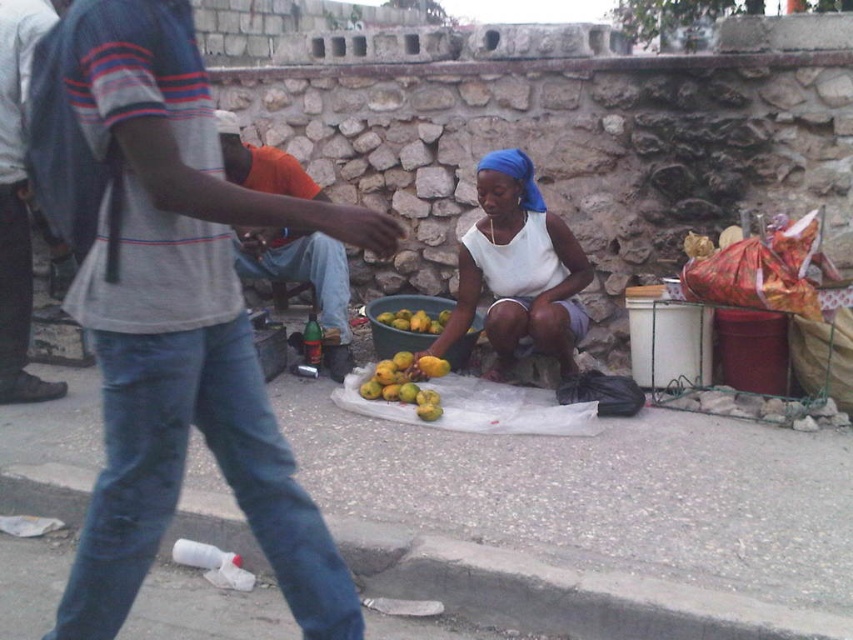
Question: Based on their relative distances, which object is nearer to the yellow matte pears at center?

Choices:
 (A) white matte tank top at center
 (B) orange fabric shirt at center

Answer: (A)

Question: Based on their relative distances, which object is farther from the smooth concrete pavement at center?

Choices:
 (A) orange fabric shirt at center
 (B) denim jeans at center
 (C) white matte tank top at center
 (D) yellow matte pears at center

Answer: (B)

Question: Which point is closer to the camera?

Choices:
 (A) (445, 324)
 (B) (195, 180)
 (C) (236, 150)

Answer: (B)

Question: Is smooth concrete pavement at center bigger than white matte tank top at center?

Choices:
 (A) no
 (B) yes

Answer: (B)

Question: Is the position of orange fabric shirt at center less distant than that of yellow matte pears at center?

Choices:
 (A) no
 (B) yes

Answer: (A)

Question: Is white matte tank top at center thinner than yellow matte pears at center?

Choices:
 (A) yes
 (B) no

Answer: (B)